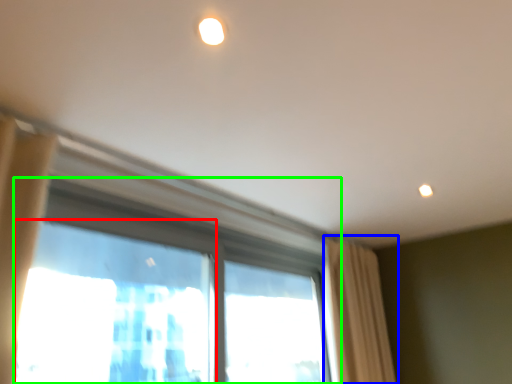
Question: Which object is the closest to the window screen (highlighted by a red box)? Choose among these: curtain (highlighted by a blue box) or window (highlighted by a green box).

Choices:
 (A) curtain
 (B) window

Answer: (B)